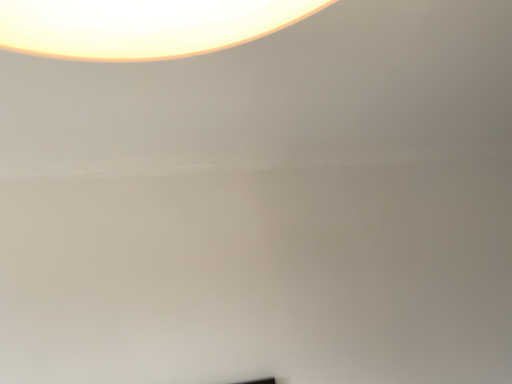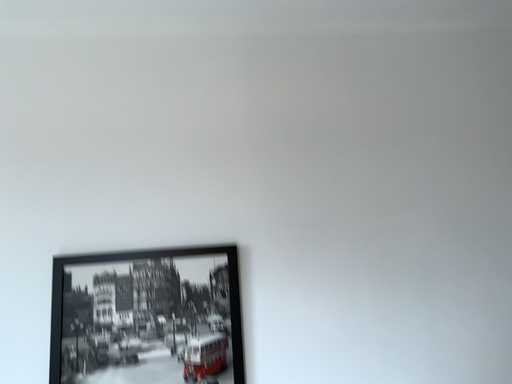
Question: How did the camera likely rotate when shooting the video?

Choices:
 (A) rotated right
 (B) rotated left

Answer: (B)